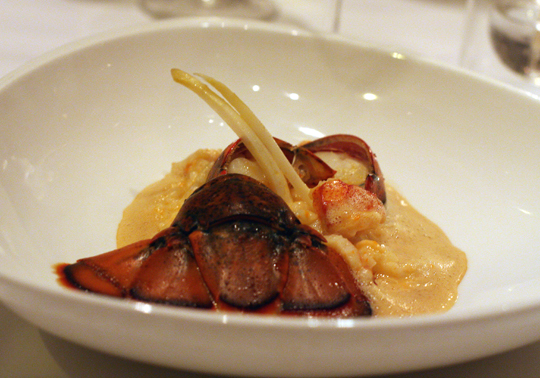
Locate an element on the screen. blurry water glass is located at coordinates (522, 45), (209, 5).